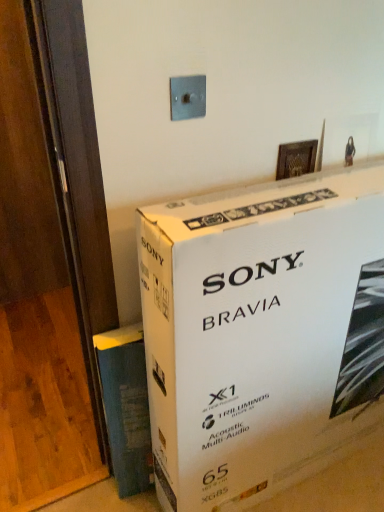
Question: Should I look upward or downward to see metallic gray switch at upper center?

Choices:
 (A) up
 (B) down

Answer: (A)

Question: Is blue textured paper at lower left at the right side of white cardboard box at upper center?

Choices:
 (A) no
 (B) yes

Answer: (A)

Question: From a real-world perspective, is blue textured paper at lower left located higher than white cardboard box at upper center?

Choices:
 (A) yes
 (B) no

Answer: (B)

Question: Does blue textured paper at lower left have a smaller size compared to white cardboard box at upper center?

Choices:
 (A) no
 (B) yes

Answer: (B)

Question: Is blue textured paper at lower left behind white cardboard box at upper center?

Choices:
 (A) yes
 (B) no

Answer: (A)

Question: Does blue textured paper at lower left have a lesser width compared to white cardboard box at upper center?

Choices:
 (A) yes
 (B) no

Answer: (A)

Question: Is blue textured paper at lower left located outside white cardboard box at upper center?

Choices:
 (A) no
 (B) yes

Answer: (B)

Question: Does white cardboard box at upper center have a greater width compared to blue textured paper at lower left?

Choices:
 (A) no
 (B) yes

Answer: (B)

Question: From a real-world perspective, is white cardboard box at upper center physically above blue textured paper at lower left?

Choices:
 (A) no
 (B) yes

Answer: (B)

Question: From a real-world perspective, does white cardboard box at upper center sit lower than blue textured paper at lower left?

Choices:
 (A) yes
 (B) no

Answer: (B)

Question: Does white cardboard box at upper center have a larger size compared to blue textured paper at lower left?

Choices:
 (A) no
 (B) yes

Answer: (B)

Question: Is white cardboard box at upper center closer to the viewer compared to blue textured paper at lower left?

Choices:
 (A) yes
 (B) no

Answer: (A)

Question: From the image's perspective, would you say white cardboard box at upper center is positioned over blue textured paper at lower left?

Choices:
 (A) yes
 (B) no

Answer: (A)

Question: Is wooden at left completely or partially inside blue textured paper at lower left?

Choices:
 (A) no
 (B) yes

Answer: (A)